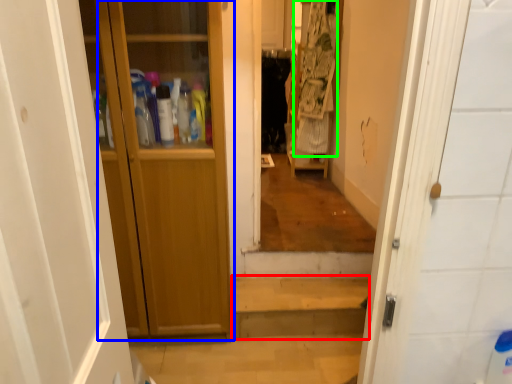
Question: Which object is the farthest from stairwell (highlighted by a red box)? Choose among these: door (highlighted by a blue box) or laundry (highlighted by a green box).

Choices:
 (A) door
 (B) laundry

Answer: (B)